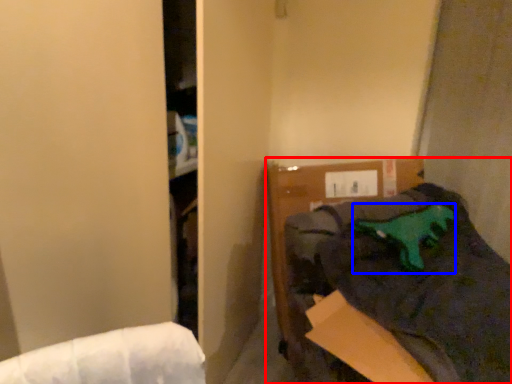
Question: Among these objects, which one is nearest to the camera, furniture (highlighted by a red box) or animal (highlighted by a blue box)?

Choices:
 (A) furniture
 (B) animal

Answer: (A)